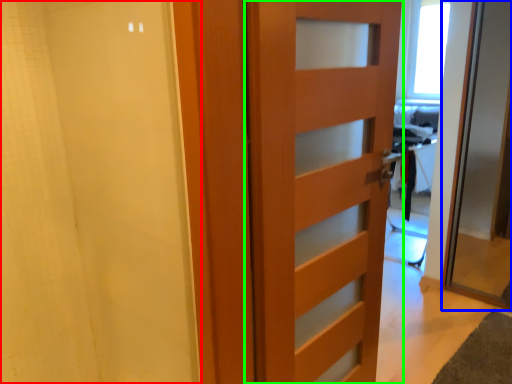
Question: Considering the real-world distances, which object is farthest from shower curtain (highlighted by a red box)? door (highlighted by a blue box) or door (highlighted by a green box)?

Choices:
 (A) door
 (B) door

Answer: (A)